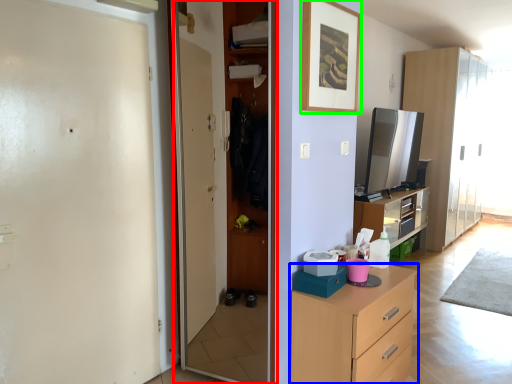
Question: Which is farther away from screen door (highlighted by a red box)? chest of drawers (highlighted by a blue box) or picture frame (highlighted by a green box)?

Choices:
 (A) chest of drawers
 (B) picture frame

Answer: (B)